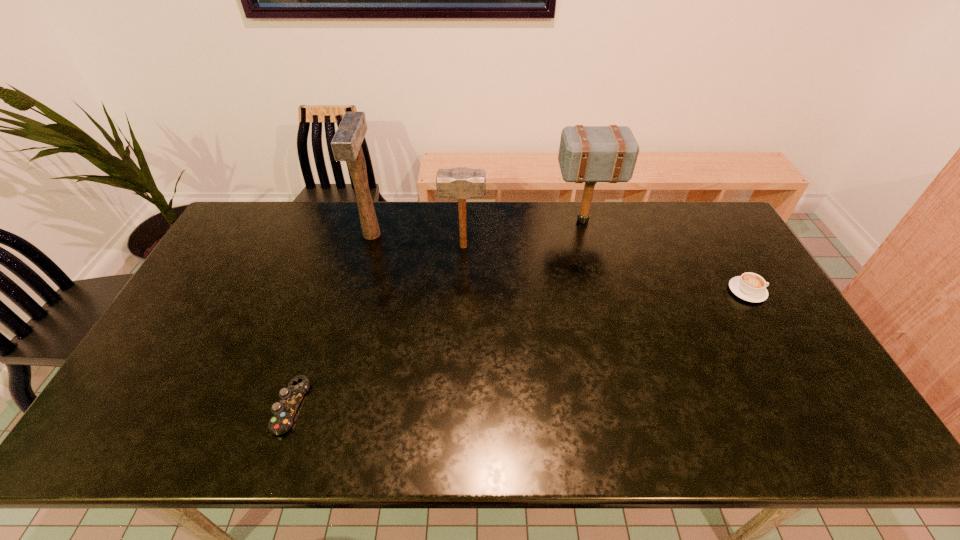
At what (x,y) coordinates should I click in order to perform the action: click on vacant space at the left edge of the desktop. Please return your answer as a coordinate pair (x, y). This screenshot has height=540, width=960. Looking at the image, I should click on (194, 316).

The height and width of the screenshot is (540, 960). Find the location of `vacant region at the far right corner`. vacant region at the far right corner is located at coordinates (706, 231).

Where is `vacant space in between the rightmost mallet and the third object from left to right`? Image resolution: width=960 pixels, height=540 pixels. vacant space in between the rightmost mallet and the third object from left to right is located at coordinates (523, 233).

Locate an element on the screen. The height and width of the screenshot is (540, 960). empty space between the tallest mallet and the second shortest object is located at coordinates (560, 263).

This screenshot has width=960, height=540. I want to click on empty location between the second nearest object and the rightmost mallet, so click(665, 256).

Find the location of `free space between the fourth object from right to left and the leftmost object`. free space between the fourth object from right to left and the leftmost object is located at coordinates (331, 320).

Identify the location of empty space between the shortest object and the shortest mallet. (377, 326).

Locate an element on the screen. vacant point located between the rightmost mallet and the leftmost object is located at coordinates (437, 313).

Find the location of a particular element. free space between the nearest object and the fourth tallest object is located at coordinates (519, 349).

Find the location of a particular element. The image size is (960, 540). free spot between the leftmost mallet and the shortest object is located at coordinates (331, 320).